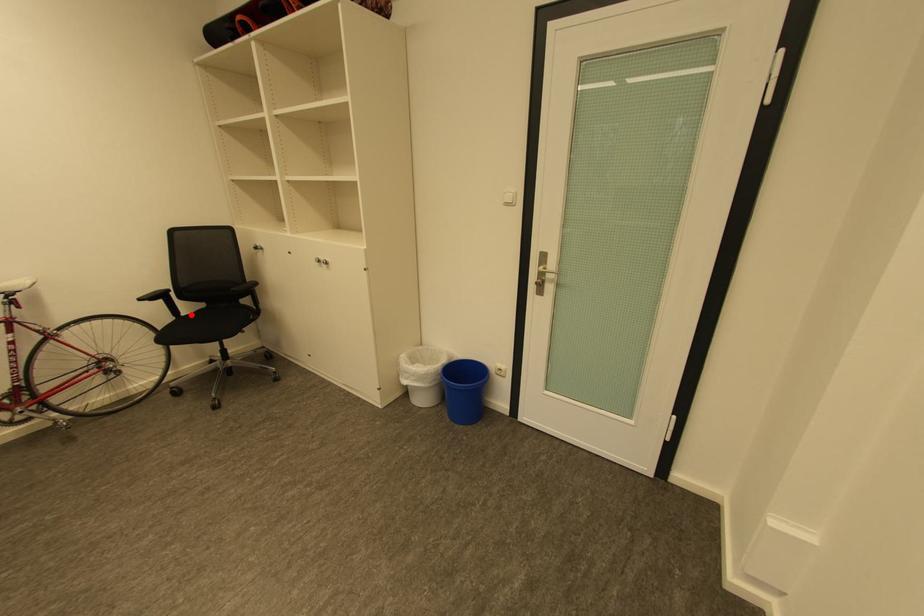
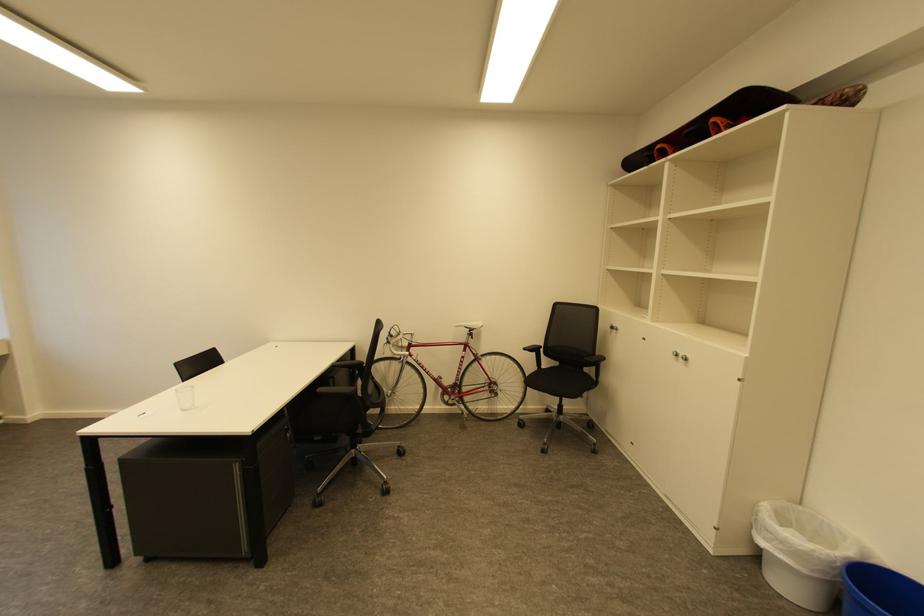
In the second image, find the point that corresponds to the highlighted location in the first image.

(551, 368)